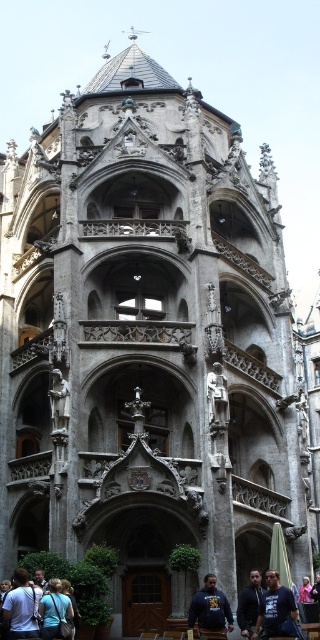
Identify the location of dark blue hoodie at lower right. (276, 609).

Is point (262, 604) positioned in front of point (56, 618)?

That is False.

This screenshot has height=640, width=320. In order to click on dark blue hoodie at lower right in this screenshot , I will do [x=276, y=609].

Which is below, dark blue sweatshirt at lower center or pink fabric jacket at lower center?

pink fabric jacket at lower center is lower down.

How far apart are dark blue sweatshirt at lower center and pink fabric jacket at lower center?

15.01 meters

Does point (210, 586) come behind point (305, 593)?

No, (210, 586) is in front of (305, 593).

At what (x,y) coordinates should I click in order to perform the action: click on dark blue sweatshirt at lower center. Please return your answer as a coordinate pair (x, y). This screenshot has height=640, width=320. Looking at the image, I should click on (209, 608).

Locate an element on the screen. The height and width of the screenshot is (640, 320). denim jacket at lower left is located at coordinates (22, 605).

Who is more distant from viewer, (6, 595) or (309, 596)?

The point (309, 596) is more distant.

Where is `denim jacket at lower left`? Image resolution: width=320 pixels, height=640 pixels. denim jacket at lower left is located at coordinates (22, 605).